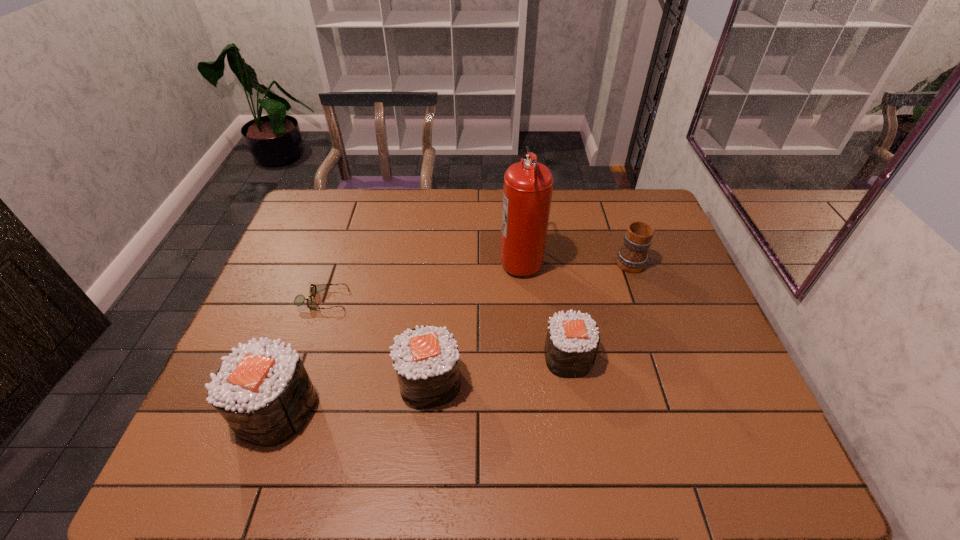
Where is `the leftmost sushi`? the leftmost sushi is located at coordinates (263, 391).

Find the location of `the third object from left to right`. the third object from left to right is located at coordinates (426, 359).

Locate an element on the screen. the second sushi from left to right is located at coordinates (426, 359).

Identify the location of the rightmost sushi. Image resolution: width=960 pixels, height=540 pixels. (572, 340).

The width and height of the screenshot is (960, 540). What are the coordinates of `mug` in the screenshot? It's located at (632, 257).

Identify the location of fire extinguisher. (527, 190).

Where is `the fourth nearest object`? The width and height of the screenshot is (960, 540). the fourth nearest object is located at coordinates (299, 300).

Where is `spectacles`? The image size is (960, 540). spectacles is located at coordinates (299, 300).

At what (x,y) coordinates should I click in order to perform the action: click on blank area located 0.240m on the back of the leftmost sushi. Please return your answer as a coordinate pair (x, y). The width and height of the screenshot is (960, 540). Looking at the image, I should click on (315, 302).

The height and width of the screenshot is (540, 960). I want to click on free space located 0.310m on the left of the second sushi from right to left, so click(x=267, y=382).